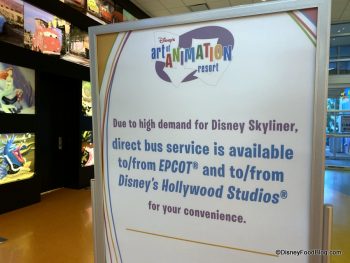
Identify the location of floor to left of sign. The width and height of the screenshot is (350, 263). (67, 228).